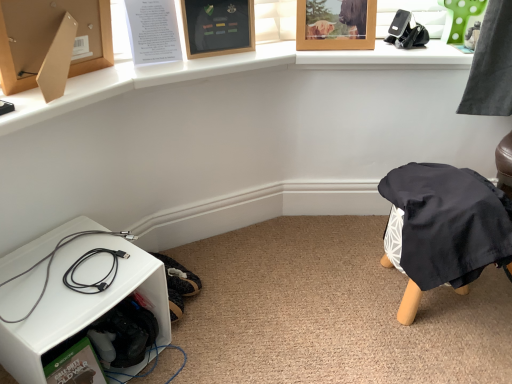
Where is `free space that is to the left of wooden picture frame at upper center, the first picture frame when ordered from right to left`? The height and width of the screenshot is (384, 512). free space that is to the left of wooden picture frame at upper center, the first picture frame when ordered from right to left is located at coordinates (280, 47).